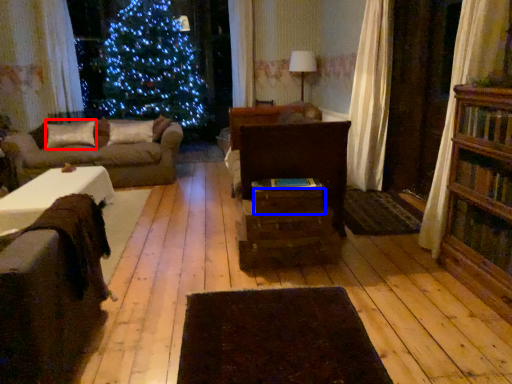
Question: Among these objects, which one is farthest to the camera, pillow (highlighted by a red box) or drawer (highlighted by a blue box)?

Choices:
 (A) pillow
 (B) drawer

Answer: (A)